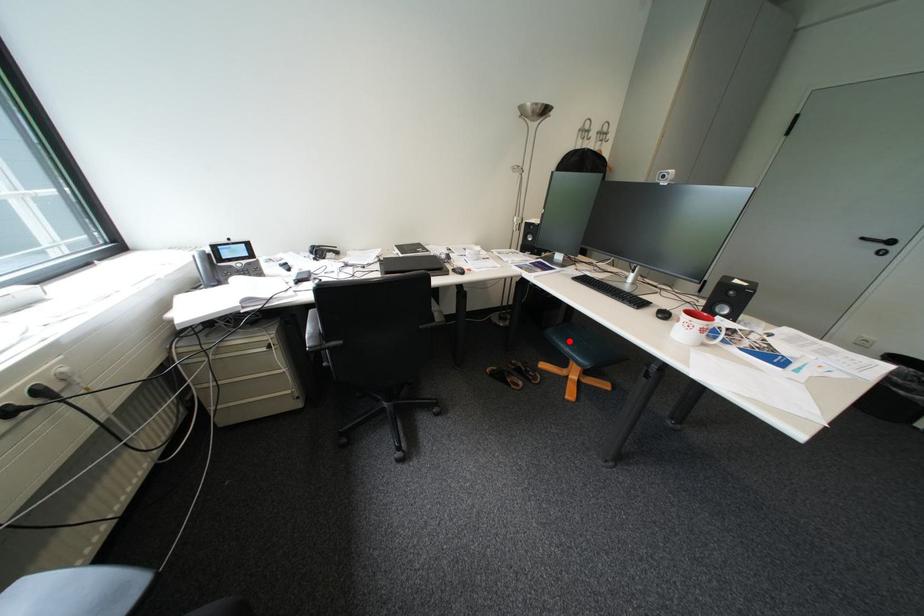
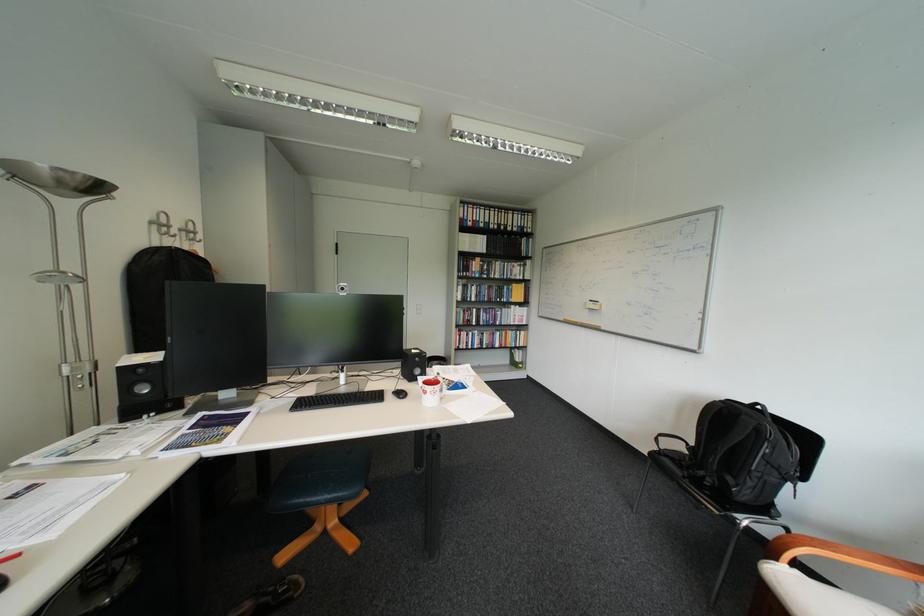
Question: A red point is marked in image1. In image2, is the corresponding 3D point closer to the camera or farther? Reply with the corresponding letter.

Choices:
 (A) The corresponding 3D point is closer.
 (B) The corresponding 3D point is farther.

Answer: (B)